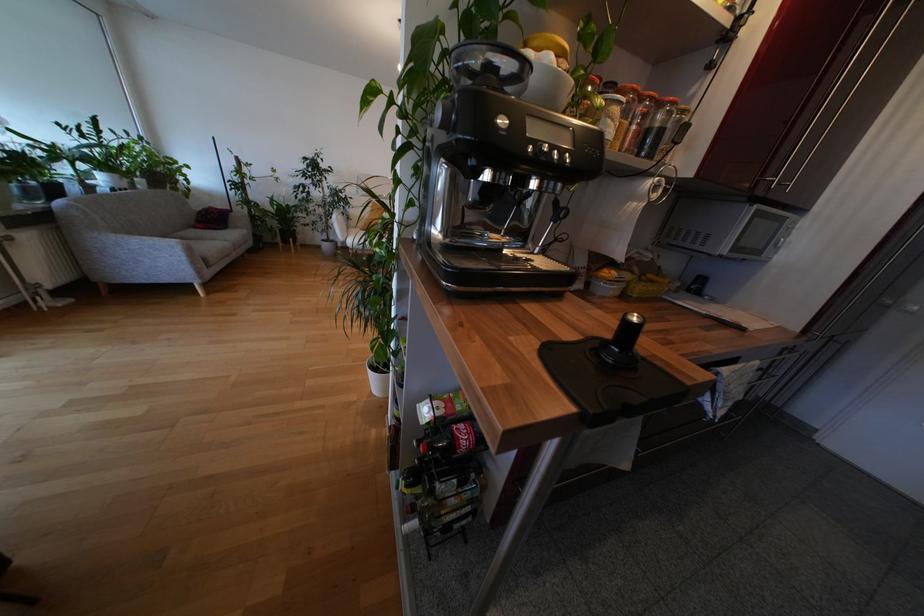
Where is `coffee machine buttons`? This screenshot has height=616, width=924. coffee machine buttons is located at coordinates (553, 155).